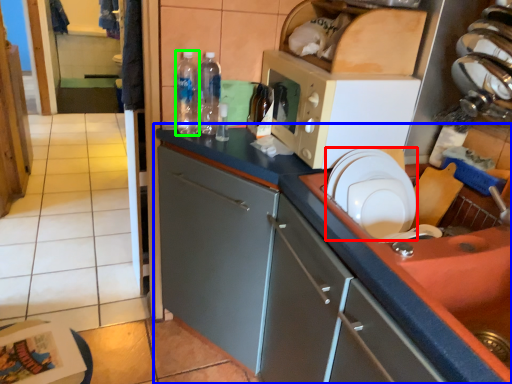
Question: Estimate the real-world distances between objects in this image. Which object is closer to paper plate (highlighted by a red box), cabinetry (highlighted by a blue box) or bottle (highlighted by a green box)?

Choices:
 (A) cabinetry
 (B) bottle

Answer: (A)